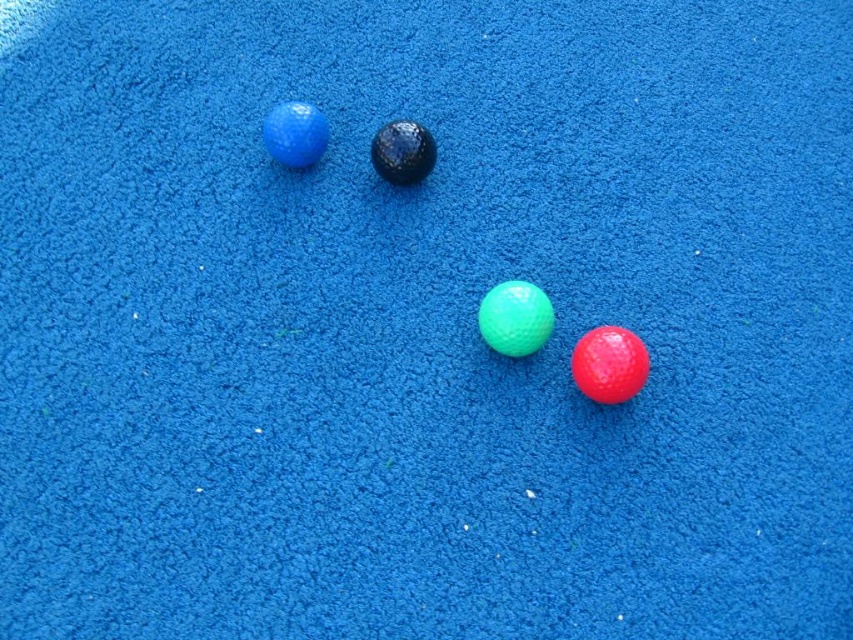
You are holding a measuring tape and need to determine if you can reach the glossy rubber ball at lower right from your current position, which is 1.5 meters away from the camera. Can you reach it?

The glossy rubber ball at lower right is only 1.35 meters away from the camera, so since you are 1.5 meters away from the camera, you are closer to the ball than the camera is. Therefore, you can reach the glossy rubber ball at lower right.

You are a child trying to stack the glossy rubber ball at lower right and the matte blue golf ball at upper left. Which one should you place at the bottom to make the stack stable?

To make the stack stable, you should place the glossy rubber ball at lower right at the bottom since it is taller than the matte blue golf ball at upper left, providing a more stable base.

You are standing at the origin point in the image. Which object corresponds to the coordinates point (608, 364)?

The glossy rubber ball at lower right corresponds to the coordinates point (608, 364).